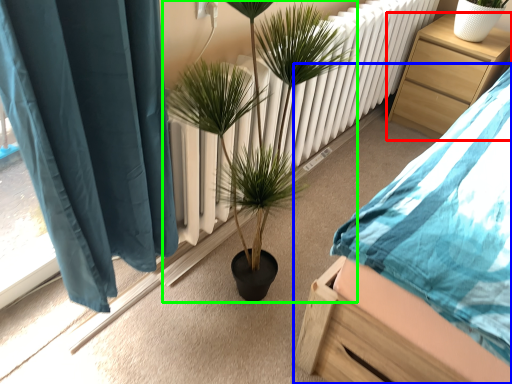
Question: Estimate the real-world distances between objects in this image. Which object is closer to nightstand (highlighted by a red box), bed (highlighted by a blue box) or houseplant (highlighted by a green box)?

Choices:
 (A) bed
 (B) houseplant

Answer: (A)